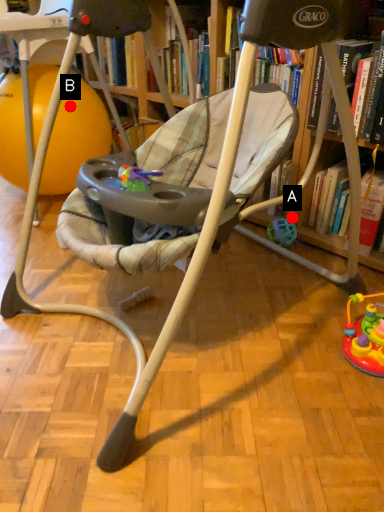
Question: Two points are circled on the image, labeled by A and B beside each circle. Which point is further to the camera?

Choices:
 (A) A is further
 (B) B is further

Answer: (B)